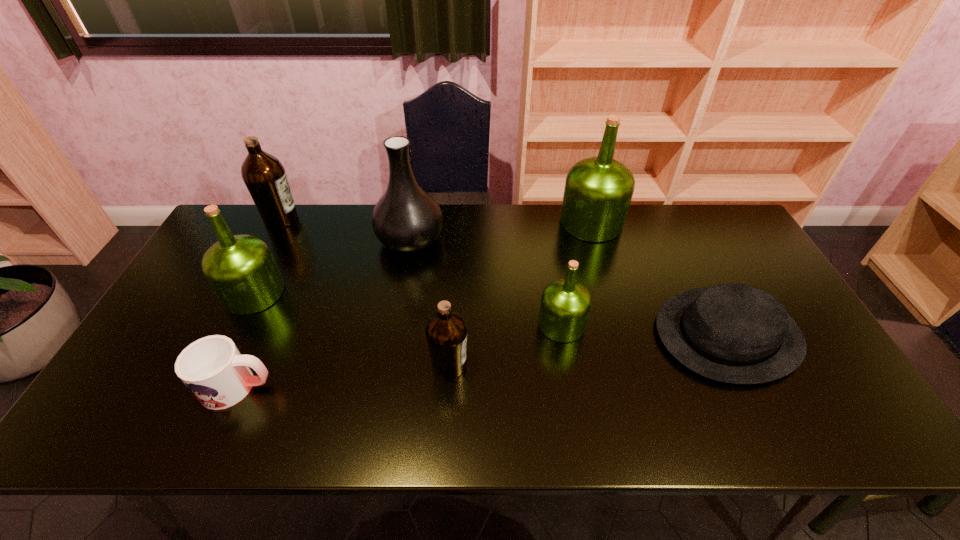
Where is `the tallest olive oil`? This screenshot has height=540, width=960. the tallest olive oil is located at coordinates (598, 191).

Where is `the farthest green olive oil`? The height and width of the screenshot is (540, 960). the farthest green olive oil is located at coordinates (598, 191).

The height and width of the screenshot is (540, 960). In order to click on vase in this screenshot , I will do pos(406,218).

Find the location of `the second biggest green olive oil`. the second biggest green olive oil is located at coordinates (241, 270).

This screenshot has height=540, width=960. I want to click on the bigger brown olive oil, so click(x=264, y=175).

Find the location of `the left brown olive oil`. the left brown olive oil is located at coordinates (264, 175).

Where is `the smallest green olive oil`? the smallest green olive oil is located at coordinates (565, 306).

This screenshot has height=540, width=960. I want to click on the right brown olive oil, so click(x=446, y=332).

The height and width of the screenshot is (540, 960). I want to click on the nearer brown olive oil, so click(446, 332).

Image resolution: width=960 pixels, height=540 pixels. What are the coordinates of `mug` in the screenshot? It's located at (212, 368).